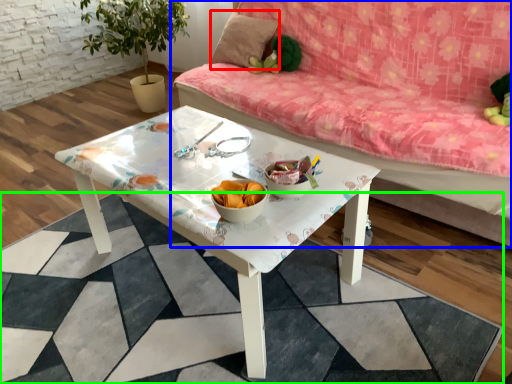
Question: Considering the real-world distances, which object is closest to pillow (highlighted by a red box)? studio couch (highlighted by a blue box) or square (highlighted by a green box).

Choices:
 (A) studio couch
 (B) square

Answer: (A)